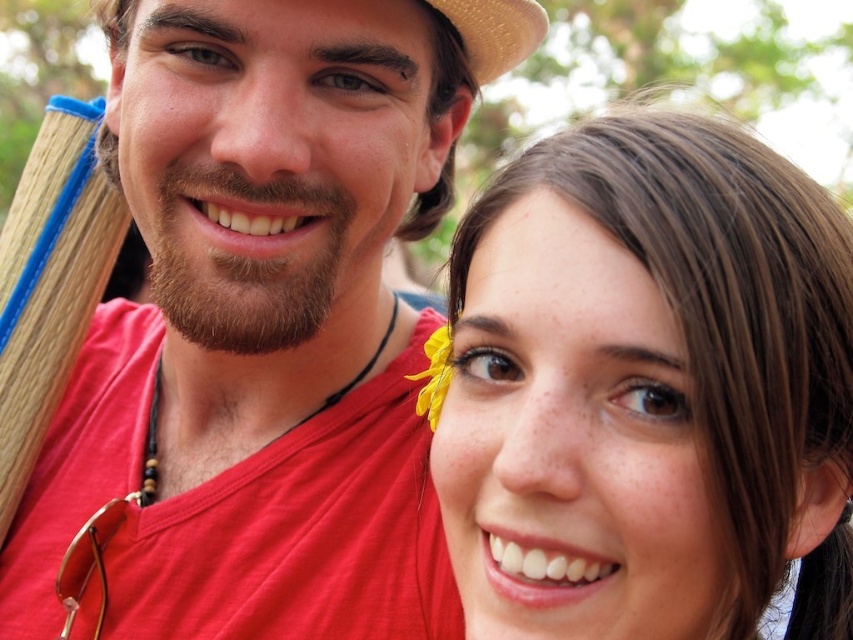
You are a photographer adjusting the camera focus. You need to ensure both the smooth brown hair at center and the yellow fabric flower at upper center are in focus. Which object should you focus on first to capture both in the same frame?

You should focus on the yellow fabric flower at upper center first because it is located above the smooth brown hair at center, allowing the depth of field to include both objects in focus.

You are a photographer trying to capture a closeup of the yellow fabric flower at upper center. Since the smooth brown hair at center is in the way, can you adjust your angle to focus on the flower without the hair blocking it?

The smooth brown hair at center is taller than the yellow fabric flower at upper center, so adjusting the angle slightly downward might allow you to capture the flower without the hair blocking it.